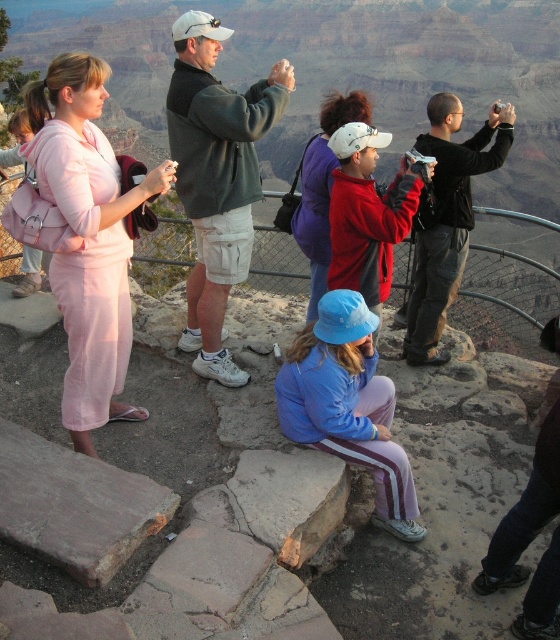
Question: Does pink fabric dress at left come in front of blue fabric jacket at center?

Choices:
 (A) no
 (B) yes

Answer: (B)

Question: In this image, where is pink fabric dress at left located relative to matte red jacket at center?

Choices:
 (A) right
 (B) left

Answer: (B)

Question: Based on their relative distances, which object is farther from the blue fabric jacket at center?

Choices:
 (A) matte red jacket at center
 (B) pink fabric dress at left

Answer: (A)

Question: Can you confirm if pink fabric dress at left is wider than blue fabric jacket at center?

Choices:
 (A) yes
 (B) no

Answer: (A)

Question: Which object is the farthest from the matte red jacket at center?

Choices:
 (A) pink fabric dress at left
 (B) blue fabric jacket at center

Answer: (A)

Question: Based on their relative distances, which object is nearer to the matte red jacket at center?

Choices:
 (A) blue fabric jacket at center
 (B) pink fabric dress at left

Answer: (A)